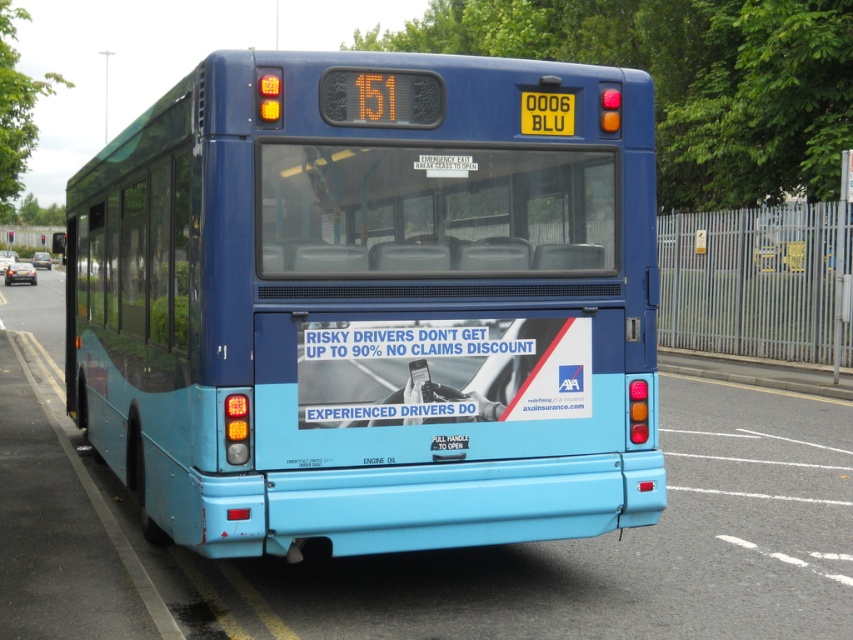
Question: Among these objects, which one is farthest from the camera?

Choices:
 (A) matte blue bus at center
 (B) yellow plastic license plate at center

Answer: (B)

Question: Is matte blue bus at center thinner than yellow plastic license plate at center?

Choices:
 (A) no
 (B) yes

Answer: (A)

Question: Is matte blue bus at center to the left of yellow plastic license plate at center from the viewer's perspective?

Choices:
 (A) yes
 (B) no

Answer: (A)

Question: Can you confirm if matte blue bus at center is positioned to the right of yellow plastic license plate at center?

Choices:
 (A) yes
 (B) no

Answer: (B)

Question: Which point is closer to the camera taking this photo?

Choices:
 (A) (572, 97)
 (B) (463, 355)

Answer: (B)